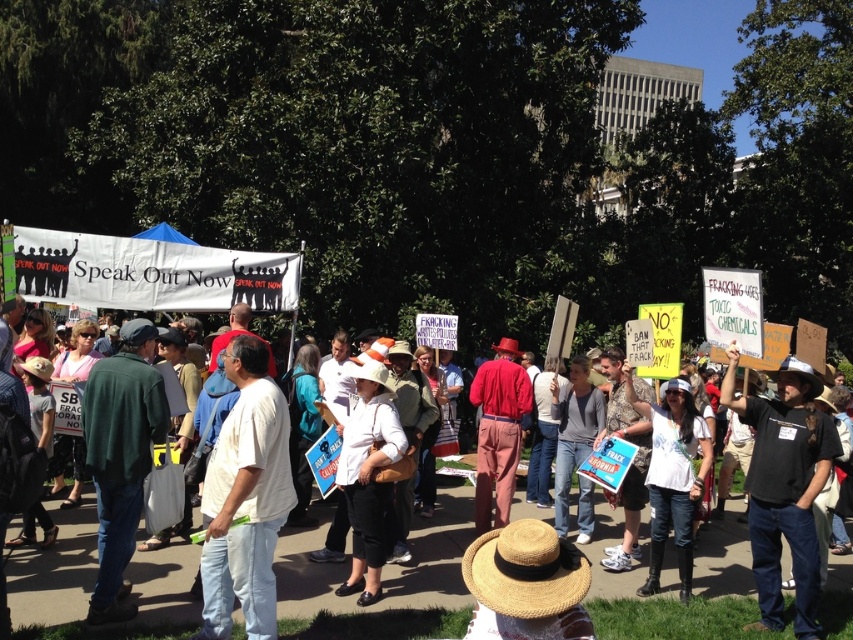
You are a photographer trying to capture a clear shot of both the white cotton shirt at center and the black cotton shirt at center. Which shirt should you focus on to ensure both are visible in the photo?

The white cotton shirt at center is positioned over the black cotton shirt at center, so focusing on the white cotton shirt at center will ensure both are visible as it is in front.

You are a photographer at the protest trying to capture a photo of both the white cotton shirt at center and the black cotton shirt at center. Which shirt should you focus on first to ensure both are in the frame?

The white cotton shirt at center occupies less space than the black cotton shirt at center, so you should focus on the black cotton shirt at center first to ensure both fit in the frame.

You are a photographer standing 2 meters away from the camera. You want to take a photo of the white cotton shirt at center. Can you reach the camera without moving it? Please explain your reasoning.

The distance between the white cotton shirt at center and the camera is 5.58 meters. Since you are already 2 meters away from the camera, you would need to move an additional 3.58 meters toward the camera to reach it. However, since the camera is stationary, you can simply extend your arm or use a remote shutter to take the photo without needing to move closer. Therefore, you can take the photo without moving the camera.